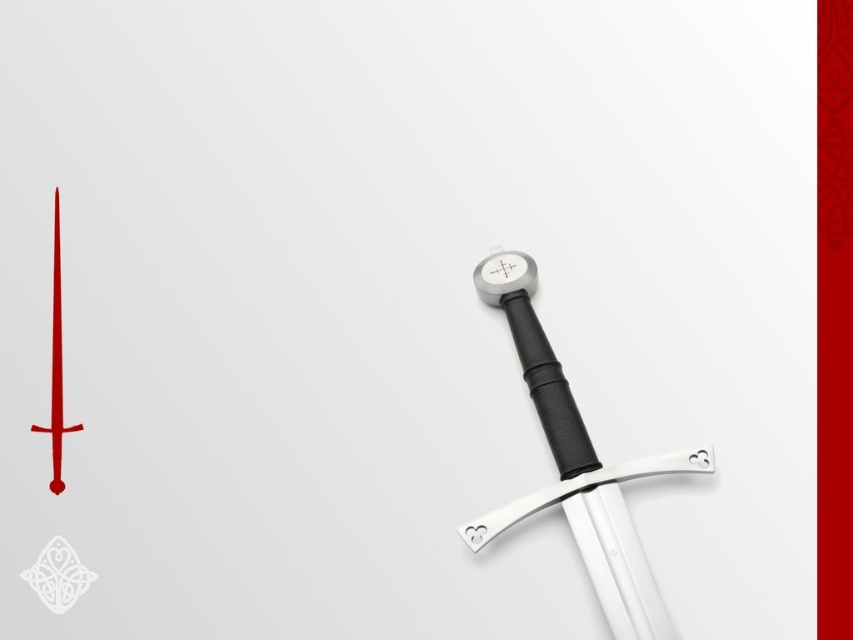
Question: Which point is farther to the camera?

Choices:
 (A) polished silver sword at right
 (B) polished silver sword at center-right

Answer: (A)

Question: Where is polished silver sword at center-right located in relation to polished silver sword at right in the image?

Choices:
 (A) above
 (B) below

Answer: (B)

Question: Can you confirm if polished silver sword at center-right is positioned to the left of polished silver sword at right?

Choices:
 (A) yes
 (B) no

Answer: (B)

Question: Among these points, which one is farthest from the camera?

Choices:
 (A) (62, 417)
 (B) (515, 304)

Answer: (B)

Question: Is polished silver sword at center-right bigger than polished silver sword at right?

Choices:
 (A) no
 (B) yes

Answer: (B)